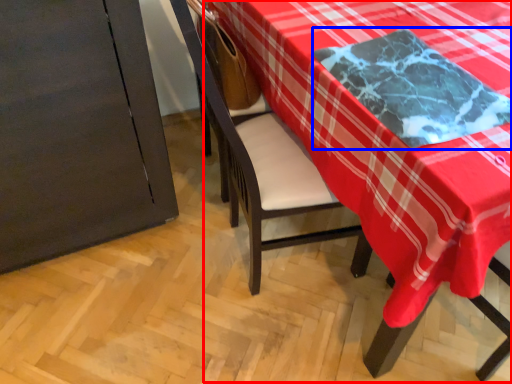
Question: Among these objects, which one is nearest to the camera, table (highlighted by a red box) or cloth (highlighted by a blue box)?

Choices:
 (A) table
 (B) cloth

Answer: (B)